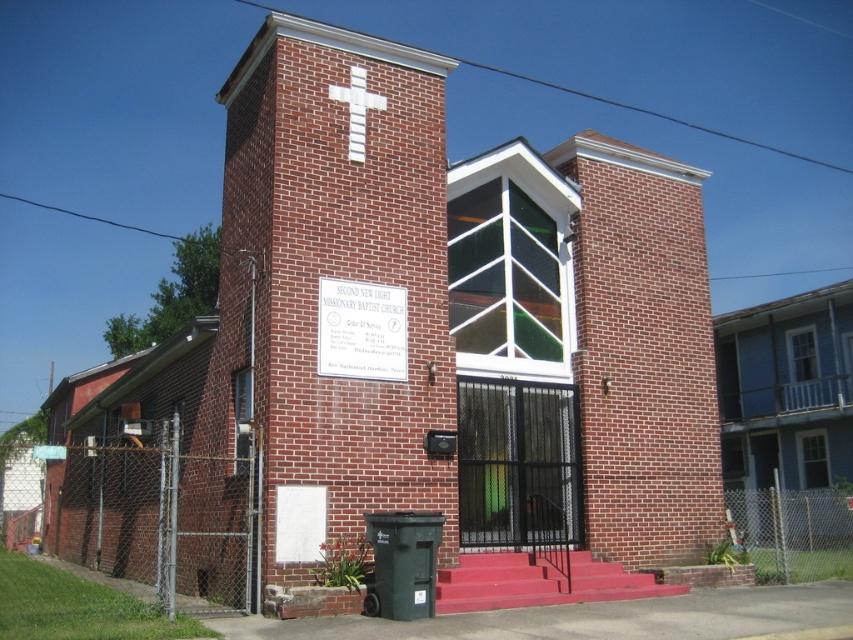
Image resolution: width=853 pixels, height=640 pixels. Describe the element at coordinates (361, 330) in the screenshot. I see `white plastic sign at center` at that location.

Can you confirm if white plastic sign at center is thinner than white painted cross at upper center?

Incorrect, white plastic sign at center's width is not less than white painted cross at upper center's.

Is point (357, 301) more distant than point (358, 141)?

No, it is in front of (358, 141).

Where is `white plastic sign at center`? Image resolution: width=853 pixels, height=640 pixels. white plastic sign at center is located at coordinates (361, 330).